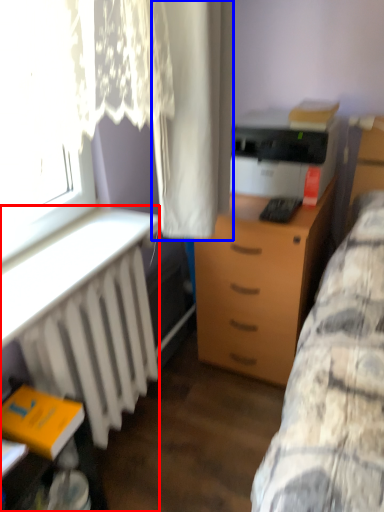
Question: Which object is closer to the camera taking this photo, desk (highlighted by a red box) or curtain (highlighted by a blue box)?

Choices:
 (A) desk
 (B) curtain

Answer: (B)